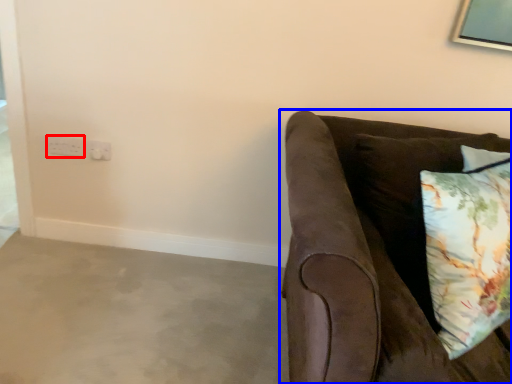
Question: Which object is closer to the camera taking this photo, electric outlet (highlighted by a red box) or studio couch (highlighted by a blue box)?

Choices:
 (A) electric outlet
 (B) studio couch

Answer: (B)